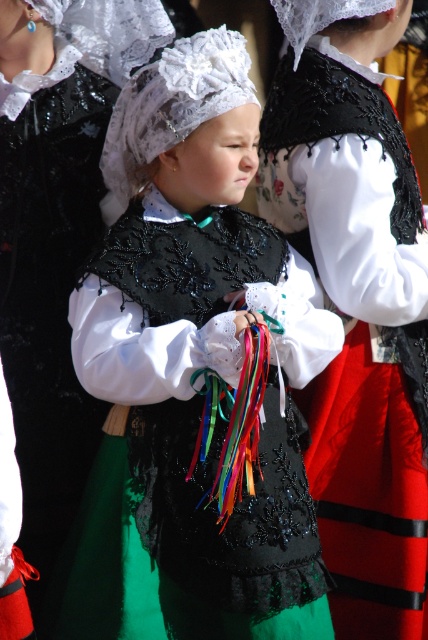
You are an event photographer trying to capture the central figures in the image. You notice the black lace vest at center and the matte black dress at center. Which one is positioned to the right side of the other?

The black lace vest at center is to the right of the matte black dress at center, so the black lace vest at center is positioned to the right side of the matte black dress at center.

Looking at this image, you are a photographer at the event and want to capture a full body shot of the young girl wearing the matte black vest at center and the matte black dress at center. Which one of her garments will require you to adjust your camera angle to ensure the entire length is visible?

The matte black dress at center is longer than the matte black vest at center, so you will need to adjust your camera angle to ensure the entire length of the matte black dress at center is visible.

You are standing in front of the image and want to determine which of the two points, point (103, 394) or point (359, 522), is nearer to you. Based on the scene description, can you identify which point is closer?

Point (103, 394) is closer to the viewer than point (359, 522).